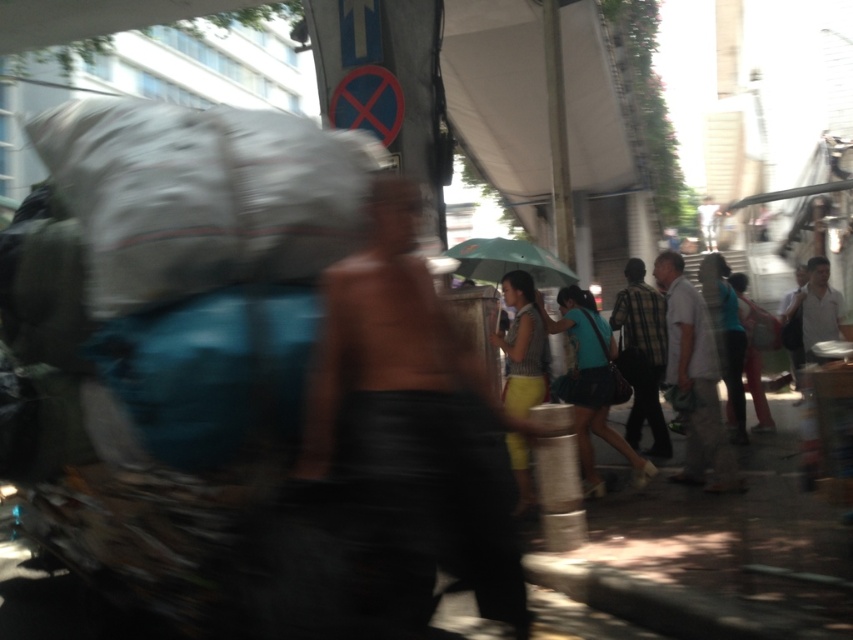
You are a delivery person in the market area. You need to determine which object is shorter between the blue fabric sack at center and the blue denim skirt at center. Which one is shorter?

The blue fabric sack at center is not as tall as the blue denim skirt at center, so the blue fabric sack at center is shorter.

You are a photographer standing in the middle of the bustling urban street scene. You want to take a photo that captures both the light blue shirt at center and the blue denim skirt at center in the same frame. Based on their distance, can you estimate if they will appear close together or far apart in the photo?

The light blue shirt at center is 65.27 centimeters from the blue denim skirt at center. In a typical camera frame, this distance would make them appear moderately close but not too far apart, so they would likely be in the same frame without needing to zoom out excessively.